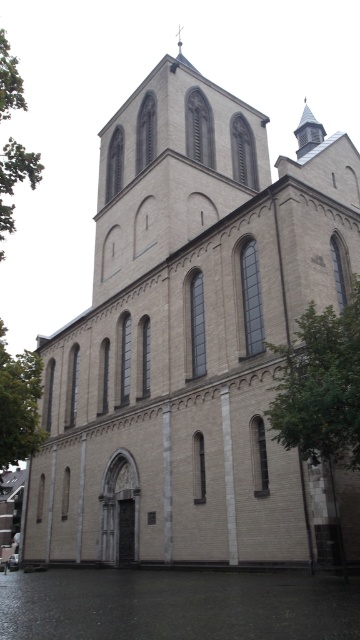
Question: Which point is farther to the camera?

Choices:
 (A) (14, 573)
 (B) (0, 442)
 (C) (2, 220)

Answer: (A)

Question: Is green leafy tree at lower left above green leafy tree at left?

Choices:
 (A) no
 (B) yes

Answer: (A)

Question: Does dark gray water at lower center have a lesser width compared to green leafy tree at left?

Choices:
 (A) no
 (B) yes

Answer: (B)

Question: Is green leafy tree at right wider than green leafy tree at lower left?

Choices:
 (A) no
 (B) yes

Answer: (A)

Question: Which is nearer to the green leafy tree at right?

Choices:
 (A) green leafy tree at left
 (B) green leafy tree at lower left

Answer: (B)

Question: Which point is closer to the camera?

Choices:
 (A) (317, 365)
 (B) (267, 618)

Answer: (B)